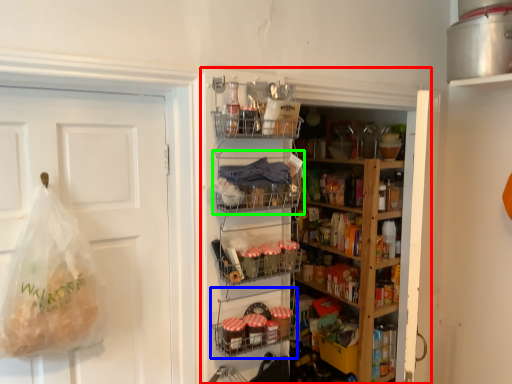
Question: Which object is positioned farthest from shelf (highlighted by a red box)? Select from shelf (highlighted by a blue box) and shelf (highlighted by a green box).

Choices:
 (A) shelf
 (B) shelf

Answer: (B)